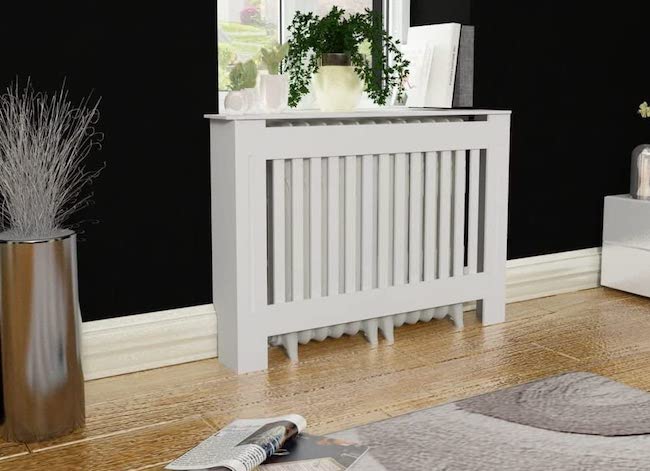
You are a GUI agent. You are given a task and a screenshot of the screen. Output one action in this format:
    pyautogui.click(x=<x>, y=<y>)
    Task: Click on the vase
    This screenshot has width=650, height=471.
    Given the screenshot: What is the action you would take?
    pyautogui.click(x=58, y=378), pyautogui.click(x=332, y=92), pyautogui.click(x=641, y=182), pyautogui.click(x=268, y=90), pyautogui.click(x=248, y=97), pyautogui.click(x=238, y=95)